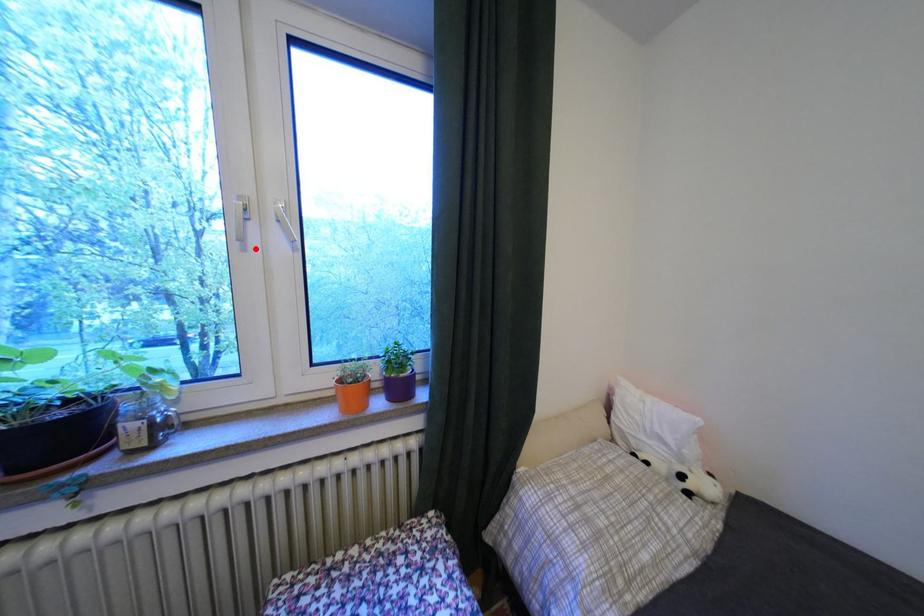
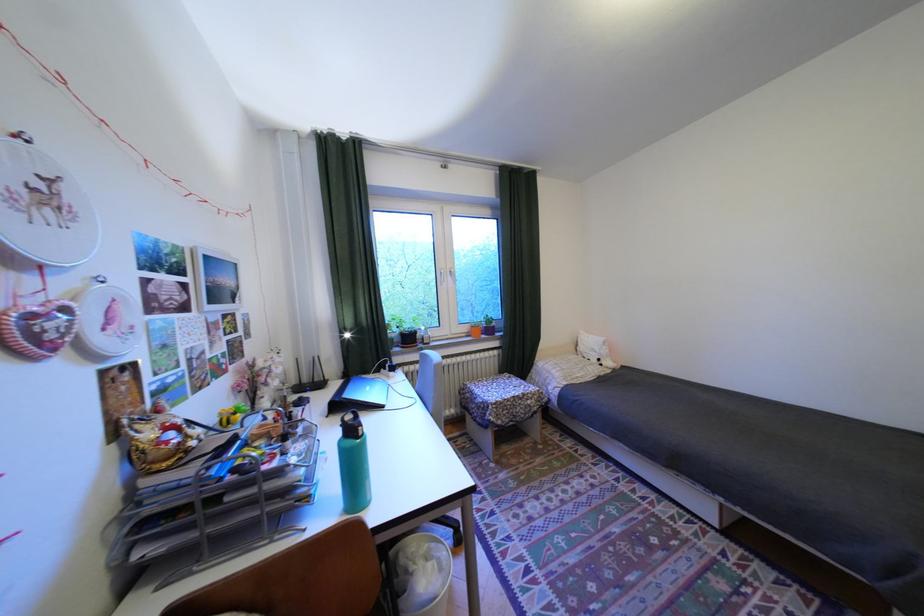
In the second image, find the point that corresponds to the highlighted location in the first image.

(454, 285)